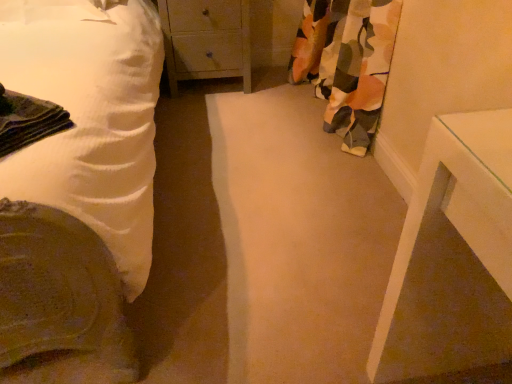
Question: Can you confirm if floral fabric curtain at right is thinner than white cotton bed at left?

Choices:
 (A) no
 (B) yes

Answer: (B)

Question: Is floral fabric curtain at right facing away from white cotton bed at left?

Choices:
 (A) yes
 (B) no

Answer: (B)

Question: Is floral fabric curtain at right at the left side of white cotton bed at left?

Choices:
 (A) no
 (B) yes

Answer: (A)

Question: Is floral fabric curtain at right behind white cotton bed at left?

Choices:
 (A) no
 (B) yes

Answer: (B)

Question: From a real-world perspective, is floral fabric curtain at right on top of white cotton bed at left?

Choices:
 (A) no
 (B) yes

Answer: (A)

Question: From a real-world perspective, is floral fabric curtain at right positioned above or below wooden chest of drawers at center?

Choices:
 (A) below
 (B) above

Answer: (B)

Question: Is floral fabric curtain at right wider or thinner than wooden chest of drawers at center?

Choices:
 (A) wide
 (B) thin

Answer: (B)

Question: Relative to wooden chest of drawers at center, is floral fabric curtain at right in front or behind?

Choices:
 (A) front
 (B) behind

Answer: (A)

Question: Is point (376, 24) positioned closer to the camera than point (205, 41)?

Choices:
 (A) closer
 (B) farther

Answer: (A)

Question: Based on their sizes in the image, would you say wooden chest of drawers at center is bigger or smaller than white cotton bed at left?

Choices:
 (A) big
 (B) small

Answer: (B)

Question: Does point (190, 56) appear closer or farther from the camera than point (18, 190)?

Choices:
 (A) farther
 (B) closer

Answer: (A)

Question: From the image's perspective, is wooden chest of drawers at center located above or below white cotton bed at left?

Choices:
 (A) below
 (B) above

Answer: (B)

Question: Relative to white cotton bed at left, is wooden chest of drawers at center in front or behind?

Choices:
 (A) front
 (B) behind

Answer: (B)

Question: Is point (183, 36) closer or farther from the camera than point (381, 26)?

Choices:
 (A) farther
 (B) closer

Answer: (A)

Question: Considering the relative positions of wooden chest of drawers at center and floral fabric curtain at right in the image provided, is wooden chest of drawers at center to the left or to the right of floral fabric curtain at right?

Choices:
 (A) left
 (B) right

Answer: (A)